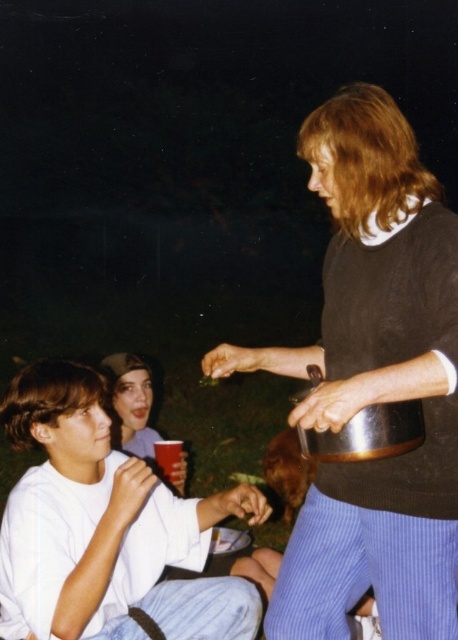
Which of these two, smooth plastic cup at lower left or translucent plastic cup at lower center, stands taller?

smooth plastic cup at lower left is taller.

Where is `smooth plastic cup at lower left`? smooth plastic cup at lower left is located at coordinates (131, 403).

Does point (136, 410) come behind point (162, 444)?

Yes.

Find the location of a particular element. The height and width of the screenshot is (640, 458). smooth plastic cup at lower left is located at coordinates (131, 403).

Is white matte shirt at lower left positioned in front of translucent plastic cup at lower center?

That is True.

Can you confirm if white matte shirt at lower left is shorter than translucent plastic cup at lower center?

No.

Identify the location of white matte shirt at lower left. This screenshot has height=640, width=458. (105, 528).

You are a GUI agent. You are given a task and a screenshot of the screen. Output one action in this format:
    pyautogui.click(x=<x>, y=<y>)
    Task: Click on the white matte shirt at lower left
    This screenshot has height=640, width=458.
    Given the screenshot: What is the action you would take?
    pyautogui.click(x=105, y=528)

In the scene shown: Is matte black sweater at center wider than smooth plastic cup at lower left?

Correct, the width of matte black sweater at center exceeds that of smooth plastic cup at lower left.

Is matte black sweater at center shorter than smooth plastic cup at lower left?

No.

What do you see at coordinates (374, 384) in the screenshot?
I see `matte black sweater at center` at bounding box center [374, 384].

At what (x,y) coordinates should I click in order to perform the action: click on matte black sweater at center. Please return your answer as a coordinate pair (x, y). The image size is (458, 640). Looking at the image, I should click on (374, 384).